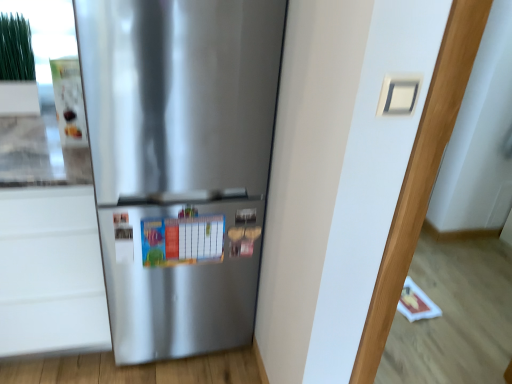
Question: Is satin silver refrigerator at center facing towards white matte drawer at lower left?

Choices:
 (A) yes
 (B) no

Answer: (B)

Question: Can you confirm if satin silver refrigerator at center is wider than white matte drawer at lower left?

Choices:
 (A) no
 (B) yes

Answer: (A)

Question: Does satin silver refrigerator at center touch white matte drawer at lower left?

Choices:
 (A) no
 (B) yes

Answer: (A)

Question: Does satin silver refrigerator at center appear on the right side of white matte drawer at lower left?

Choices:
 (A) yes
 (B) no

Answer: (A)

Question: From the image's perspective, does satin silver refrigerator at center appear higher than white matte drawer at lower left?

Choices:
 (A) yes
 (B) no

Answer: (A)

Question: From the image's perspective, is satin silver refrigerator at center under white matte drawer at lower left?

Choices:
 (A) no
 (B) yes

Answer: (A)

Question: From a real-world perspective, is satin silver refrigerator at center over white matte door at center?

Choices:
 (A) no
 (B) yes

Answer: (A)

Question: Considering the relative sizes of satin silver refrigerator at center and white matte door at center in the image provided, is satin silver refrigerator at center wider than white matte door at center?

Choices:
 (A) yes
 (B) no

Answer: (A)

Question: Can you confirm if satin silver refrigerator at center is positioned to the left of white matte door at center?

Choices:
 (A) no
 (B) yes

Answer: (B)

Question: Is satin silver refrigerator at center completely or partially outside of white matte door at center?

Choices:
 (A) no
 (B) yes

Answer: (B)

Question: Can you confirm if satin silver refrigerator at center is shorter than white matte door at center?

Choices:
 (A) no
 (B) yes

Answer: (B)

Question: Considering the relative sizes of satin silver refrigerator at center and white matte door at center in the image provided, is satin silver refrigerator at center thinner than white matte door at center?

Choices:
 (A) yes
 (B) no

Answer: (B)

Question: Could white matte door at center be considered to be inside white matte drawer at lower left?

Choices:
 (A) yes
 (B) no

Answer: (B)